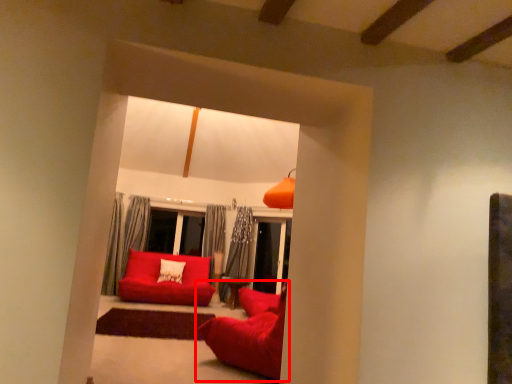
Question: From the image's perspective, what is the correct spatial positioning of studio couch (annotated by the red box) in reference to studio couch?

Choices:
 (A) below
 (B) above

Answer: (B)